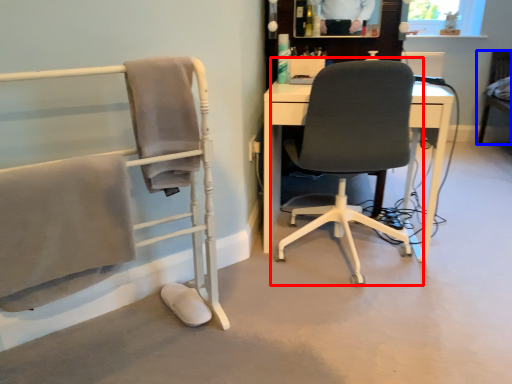
Question: Which object appears farthest to the camera in this image, chair (highlighted by a red box) or chair (highlighted by a blue box)?

Choices:
 (A) chair
 (B) chair

Answer: (B)